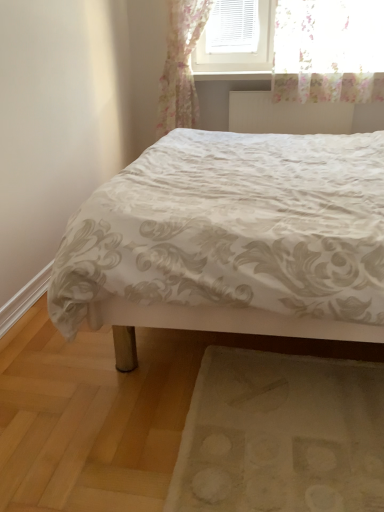
Question: Is beige fabric mat at lower right positioned behind white satin bed at center?

Choices:
 (A) yes
 (B) no

Answer: (A)

Question: From the image's perspective, is beige fabric mat at lower right over white satin bed at center?

Choices:
 (A) yes
 (B) no

Answer: (B)

Question: From a real-world perspective, is beige fabric mat at lower right on white satin bed at center?

Choices:
 (A) no
 (B) yes

Answer: (A)

Question: Is beige fabric mat at lower right at the right side of white satin bed at center?

Choices:
 (A) no
 (B) yes

Answer: (A)

Question: Does beige fabric mat at lower right have a larger size compared to white satin bed at center?

Choices:
 (A) yes
 (B) no

Answer: (B)

Question: Could you tell me if beige fabric mat at lower right is turned towards white satin bed at center?

Choices:
 (A) no
 (B) yes

Answer: (B)

Question: Is white satin bed at center to the left of beige fabric mat at lower right from the viewer's perspective?

Choices:
 (A) yes
 (B) no

Answer: (B)

Question: From a real-world perspective, is white satin bed at center on beige fabric mat at lower right?

Choices:
 (A) yes
 (B) no

Answer: (A)

Question: Considering the relative sizes of white satin bed at center and beige fabric mat at lower right in the image provided, is white satin bed at center shorter than beige fabric mat at lower right?

Choices:
 (A) yes
 (B) no

Answer: (B)

Question: From a real-world perspective, is white satin bed at center under beige fabric mat at lower right?

Choices:
 (A) no
 (B) yes

Answer: (A)

Question: From the image's perspective, is white satin bed at center over beige fabric mat at lower right?

Choices:
 (A) no
 (B) yes

Answer: (B)

Question: Can beige fabric mat at lower right be found inside white satin bed at center?

Choices:
 (A) yes
 (B) no

Answer: (A)

Question: From the image's perspective, would you say white textured radiator at upper center is positioned over beige fabric mat at lower right?

Choices:
 (A) no
 (B) yes

Answer: (B)